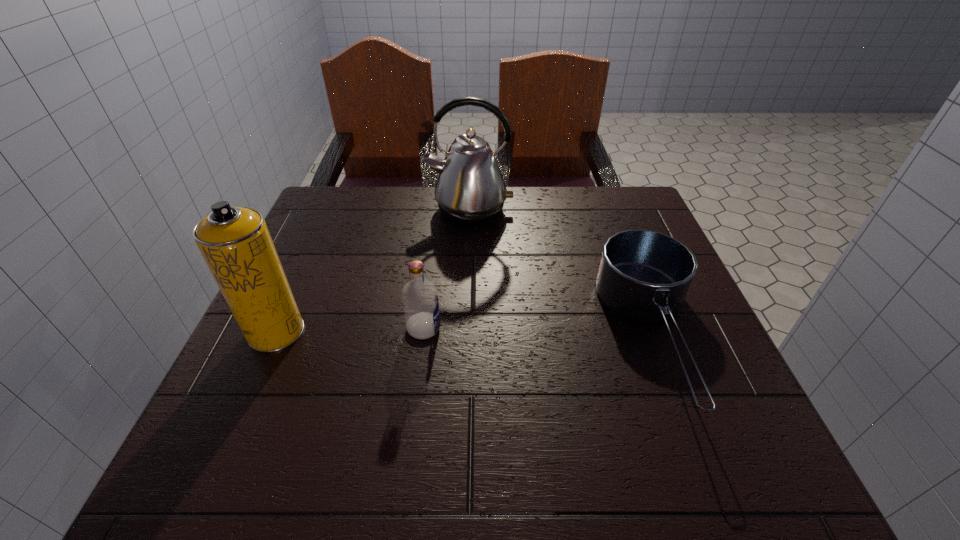
Identify the location of the farthest object. 470,189.

Image resolution: width=960 pixels, height=540 pixels. I want to click on aerosol can, so click(235, 242).

Where is `vodka`? This screenshot has width=960, height=540. vodka is located at coordinates (420, 301).

This screenshot has height=540, width=960. I want to click on the shortest object, so click(x=644, y=275).

Image resolution: width=960 pixels, height=540 pixels. I want to click on saucepan, so click(644, 275).

At what (x,y) coordinates should I click in order to perform the action: click on free space located 0.330m from the spout of the kettle. Please return your answer as a coordinate pair (x, y). Looking at the image, I should click on (466, 327).

Identify the location of free space located on the right of the leftmost object. (353, 332).

What are the coordinates of `vacant space located on the label of the third tallest object` in the screenshot? It's located at (530, 328).

Find the location of a particular element. The height and width of the screenshot is (540, 960). object that is positioned at the far edge is located at coordinates (470, 189).

Identify the location of object present at the near edge. This screenshot has height=540, width=960. (644, 275).